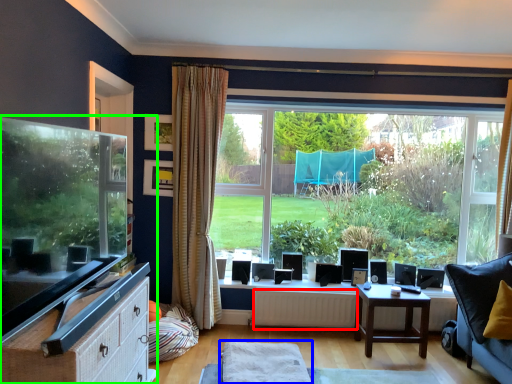
Question: Estimate the real-world distances between objects in this image. Which object is closer to radiator (highlighted by a red box), plain (highlighted by a blue box) or entertainment center (highlighted by a green box)?

Choices:
 (A) plain
 (B) entertainment center

Answer: (A)